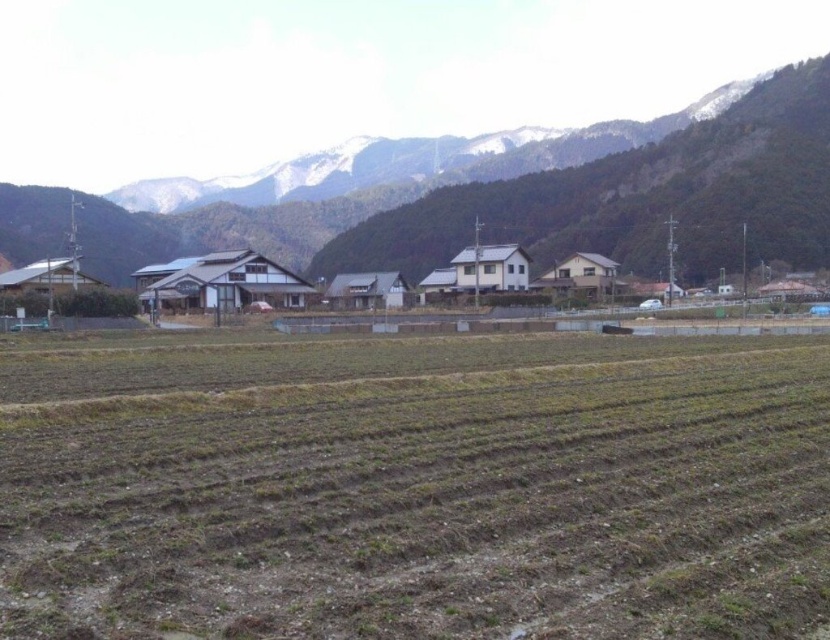
Which is more to the left, brown soil field at lower center or snowy rock mountain at upper center?

From the viewer's perspective, snowy rock mountain at upper center appears more on the left side.

Does brown soil field at lower center have a larger size compared to snowy rock mountain at upper center?

Incorrect, brown soil field at lower center is not larger than snowy rock mountain at upper center.

This screenshot has width=830, height=640. I want to click on brown soil field at lower center, so click(x=413, y=486).